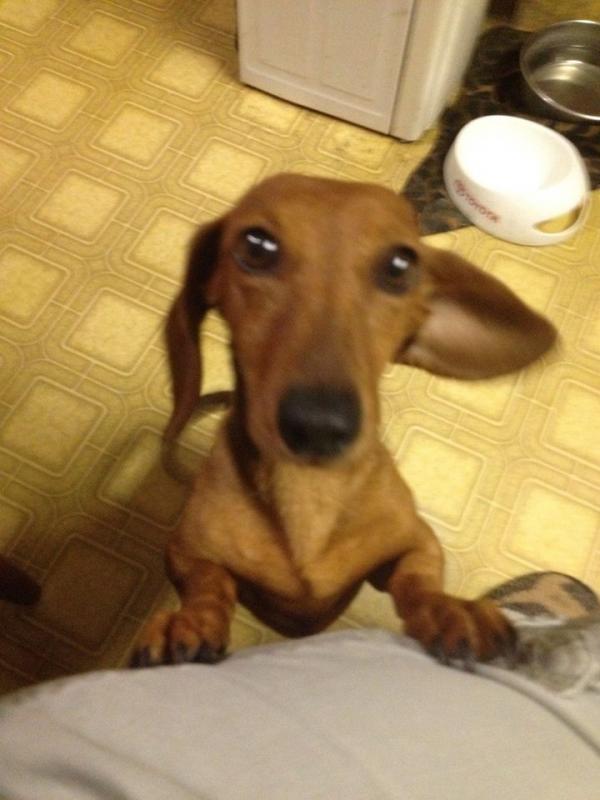
Image resolution: width=600 pixels, height=800 pixels. Identify the location of nasty yellowish floor. (543, 533).